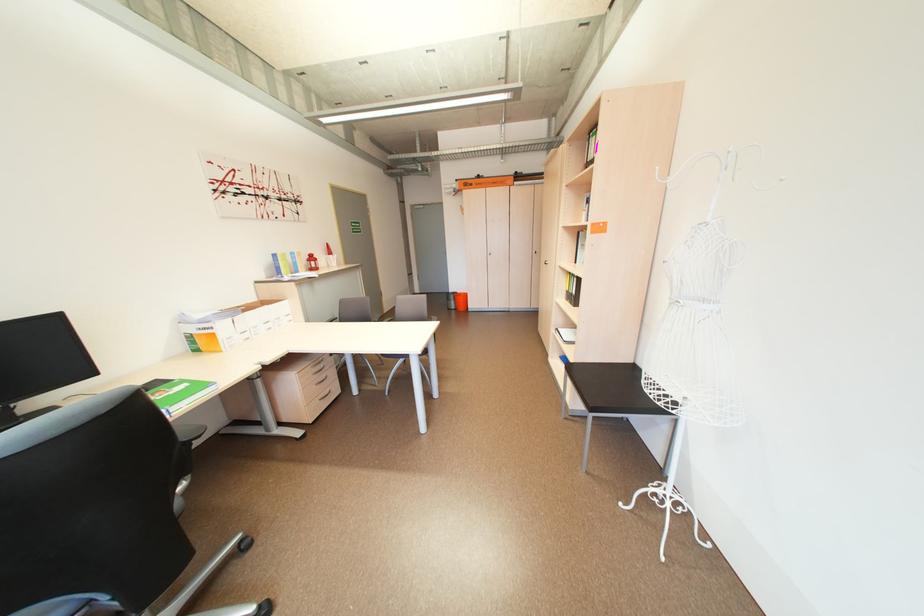
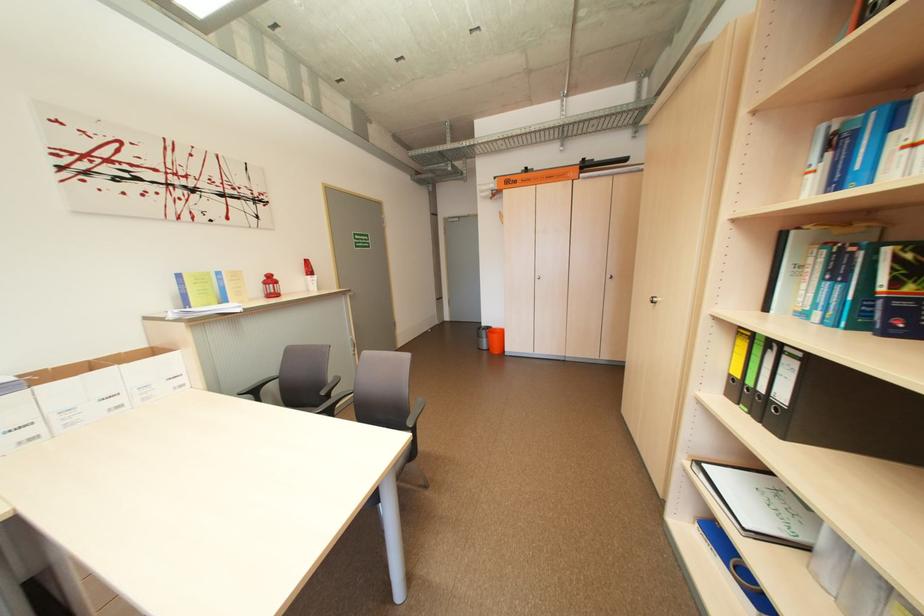
Locate, in the second image, the point that corresponds to the point at 319,261 in the first image.

(274, 284)